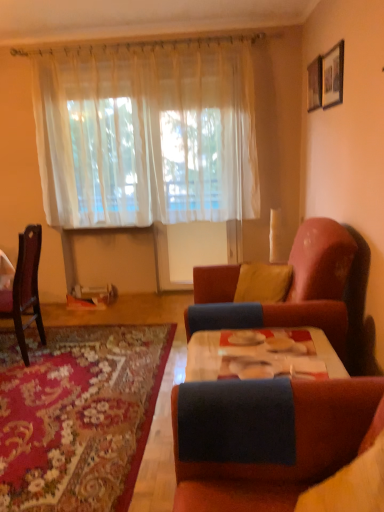
I want to click on blank space situated above carpeted rug at lower left (from a real-world perspective), so click(81, 368).